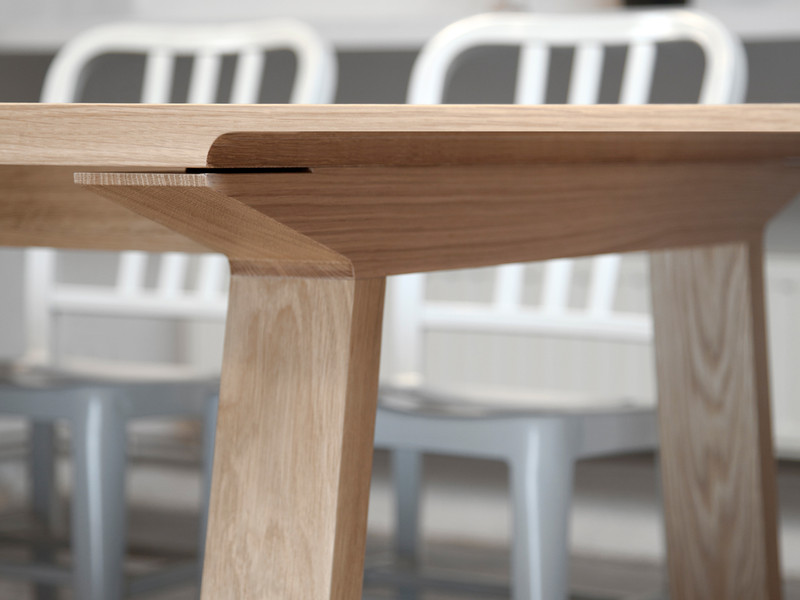
Where is `tabletop support`? Image resolution: width=800 pixels, height=600 pixels. tabletop support is located at coordinates (514, 203).